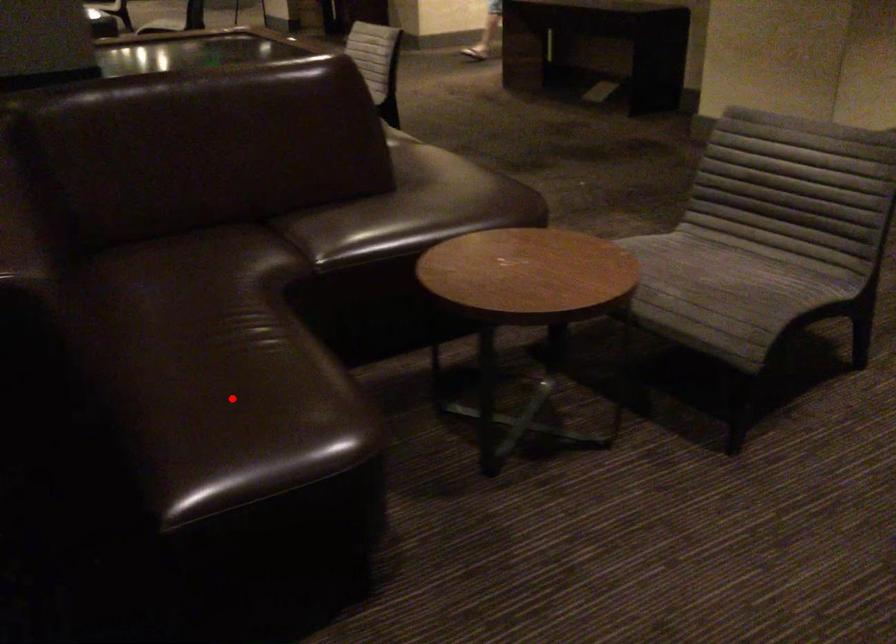
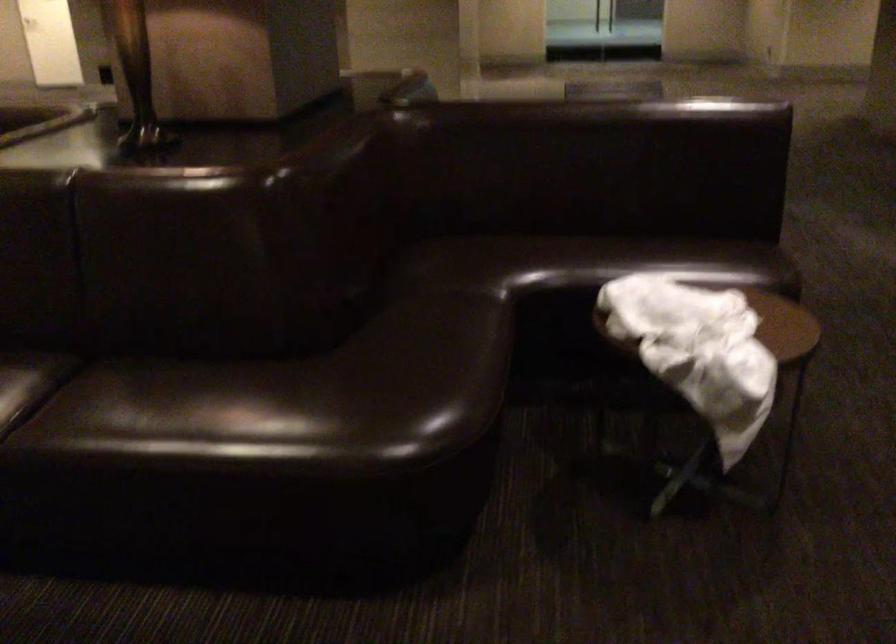
Question: I am providing you with two images of the same scene from different viewpoints. A red point is marked on the first image. At the location where the point appears in image 1, is it still visible in image 2?

Choices:
 (A) Yes
 (B) No

Answer: (B)